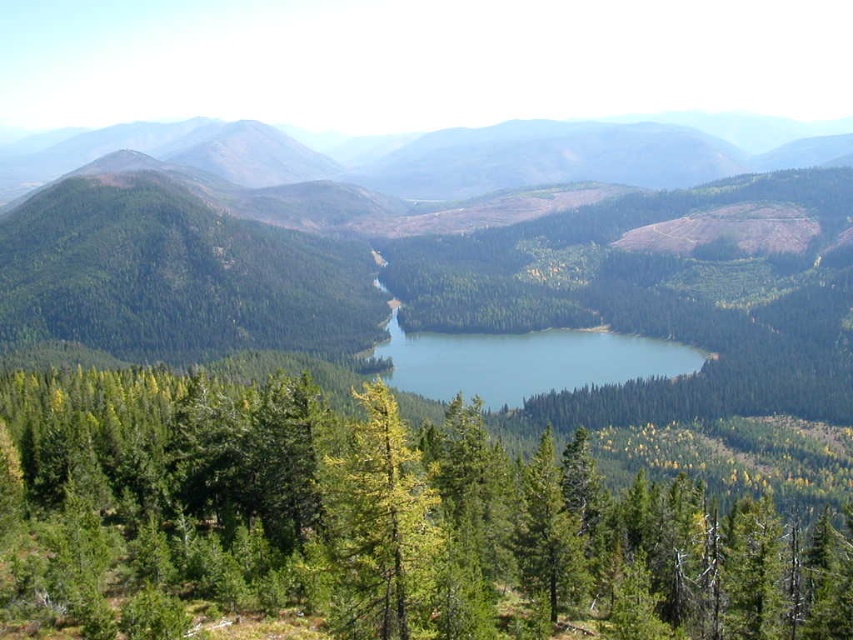
Is the position of green matte tree at center more distant than that of blue glossy water at center?

No, green matte tree at center is closer to the viewer.

Does green matte tree at center have a greater width compared to blue glossy water at center?

Correct, the width of green matte tree at center exceeds that of blue glossy water at center.

Between point (115, 449) and point (421, 394), which one is positioned in front?

Point (115, 449) is in front.

The image size is (853, 640). What are the coordinates of `green matte tree at center` in the screenshot? It's located at (376, 518).

Can you confirm if yellow-green needle-like tree at center is positioned below blue glossy water at center?

Correct, yellow-green needle-like tree at center is located below blue glossy water at center.

Is point (410, 512) farther from camera compared to point (396, 349)?

No, (410, 512) is closer to viewer.

Which is in front, point (422, 488) or point (403, 348)?

Positioned in front is point (422, 488).

You are a GUI agent. You are given a task and a screenshot of the screen. Output one action in this format:
    pyautogui.click(x=<x>, y=<y>)
    Task: Click on the yellow-green needle-like tree at center
    
    Given the screenshot: What is the action you would take?
    (x=381, y=525)

How much distance is there between green matte tree at center and yellow-green needle-like tree at center?

green matte tree at center and yellow-green needle-like tree at center are 13.64 meters apart.

Which of these two, green matte tree at center or yellow-green needle-like tree at center, stands taller?

Standing taller between the two is green matte tree at center.

Find the location of a particular element. green matte tree at center is located at coordinates (376, 518).